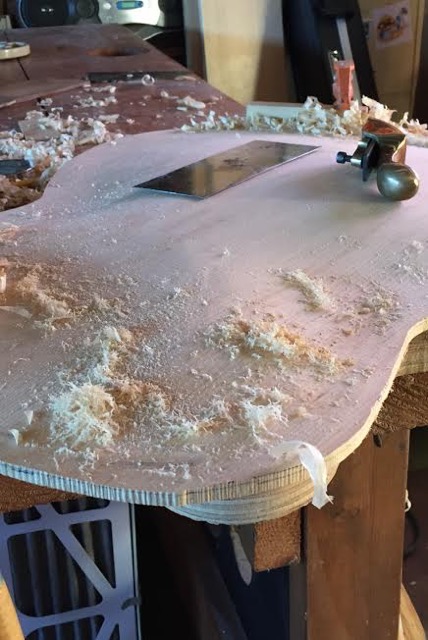
I want to click on space under table, so click(x=183, y=598).